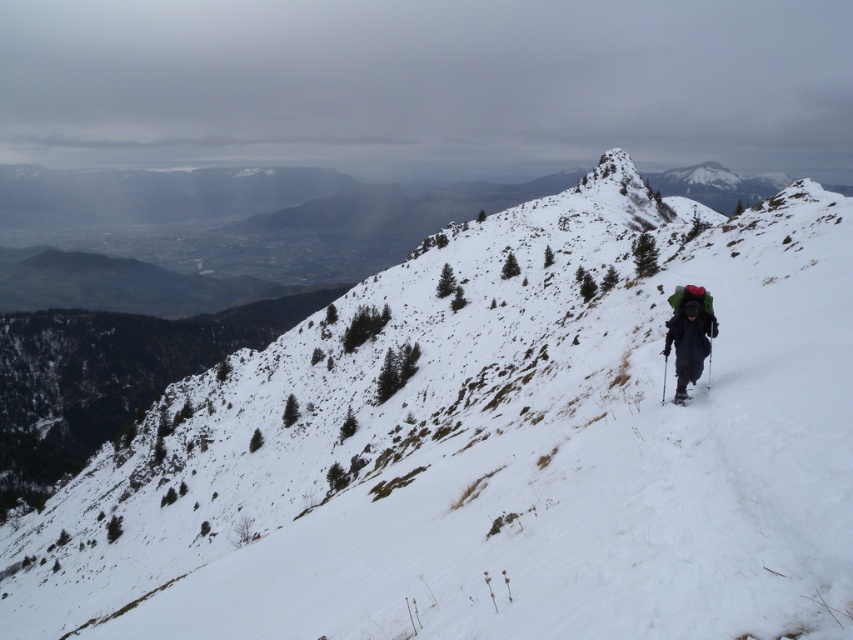
Question: Among these objects, which one is farthest from the camera?

Choices:
 (A) dark blue fabric backpack at center-right
 (B) black matte ski at center-right

Answer: (A)

Question: Which of the following is the farthest from the observer?

Choices:
 (A) dark blue fabric backpack at center-right
 (B) black matte ski at center-right

Answer: (A)

Question: Does dark blue fabric backpack at center-right appear over black matte ski at center-right?

Choices:
 (A) no
 (B) yes

Answer: (B)

Question: Is the position of dark blue fabric backpack at center-right less distant than that of black matte ski at center-right?

Choices:
 (A) no
 (B) yes

Answer: (A)

Question: Does dark blue fabric backpack at center-right appear on the right side of black matte ski at center-right?

Choices:
 (A) no
 (B) yes

Answer: (B)